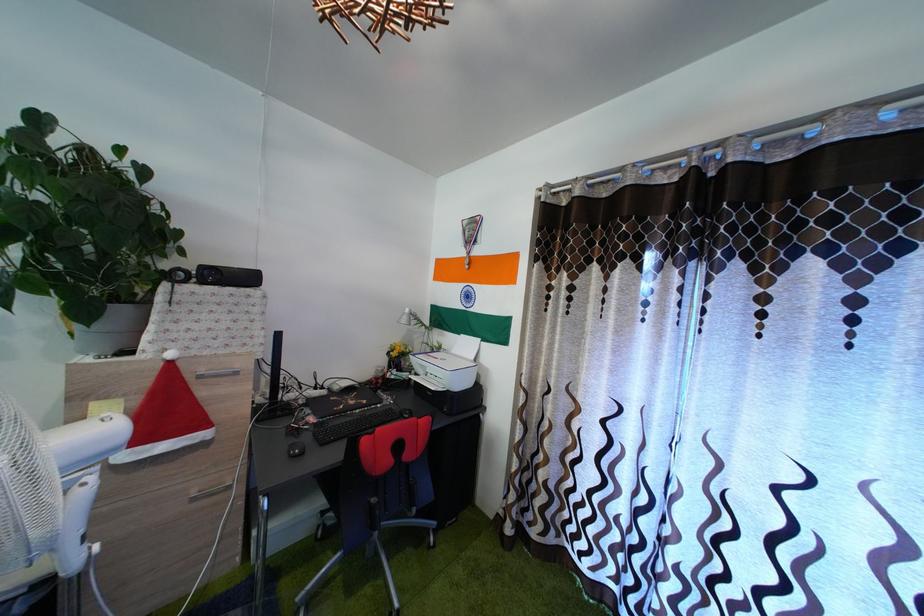
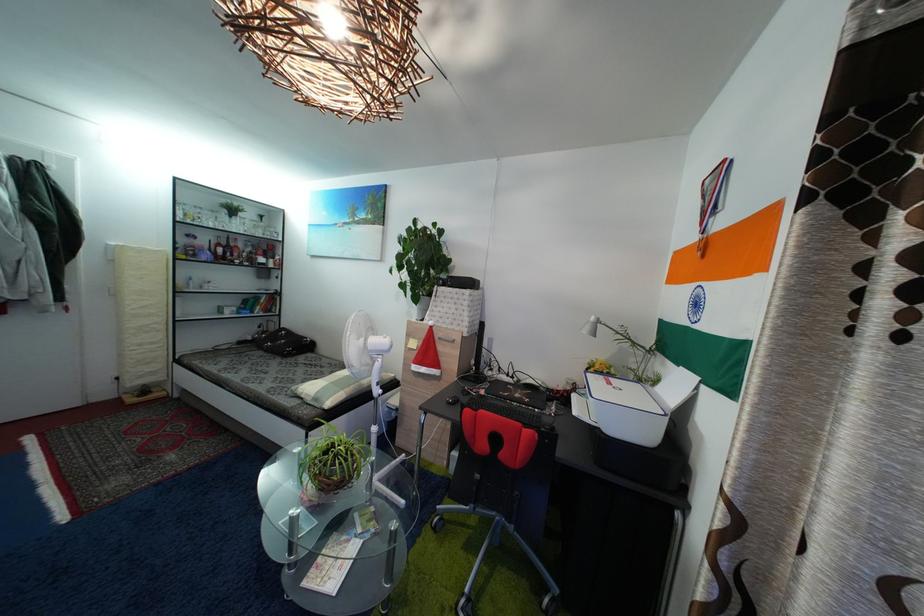
Find the pixel in the second image that matches (396,361) in the first image.

(596, 377)